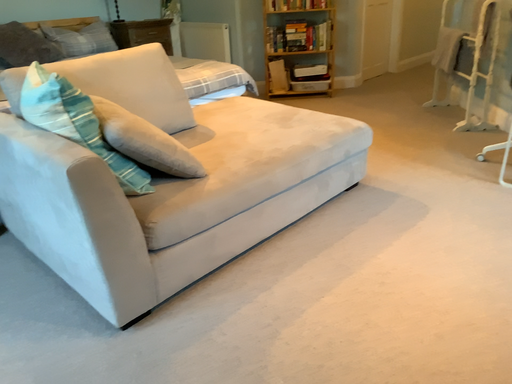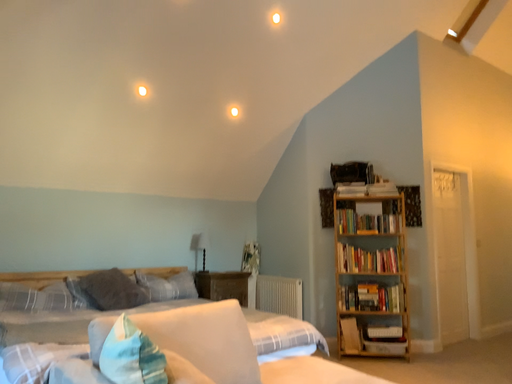
Question: Which way did the camera rotate in the video?

Choices:
 (A) rotated upward
 (B) rotated downward

Answer: (A)